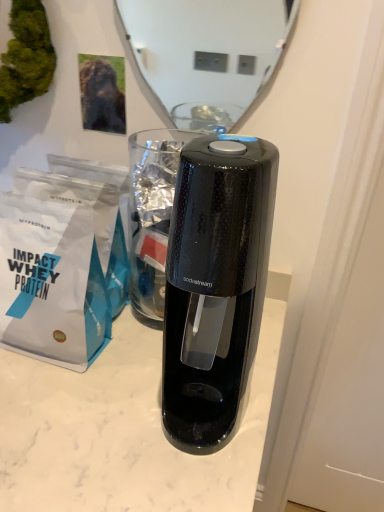
Question: From the image's perspective, is white matte paper bag at left above or below green moss at upper left?

Choices:
 (A) above
 (B) below

Answer: (B)

Question: Considering the positions of white matte paper bag at left and green moss at upper left in the image, is white matte paper bag at left wider or thinner than green moss at upper left?

Choices:
 (A) thin
 (B) wide

Answer: (B)

Question: Considering the real-world distances, which object is farthest from the green moss at upper left?

Choices:
 (A) glossy white mirror at upper center
 (B) white matte paper bag at left

Answer: (A)

Question: Which object is the closest to the glossy white mirror at upper center?

Choices:
 (A) white matte paper bag at left
 (B) green moss at upper left

Answer: (B)